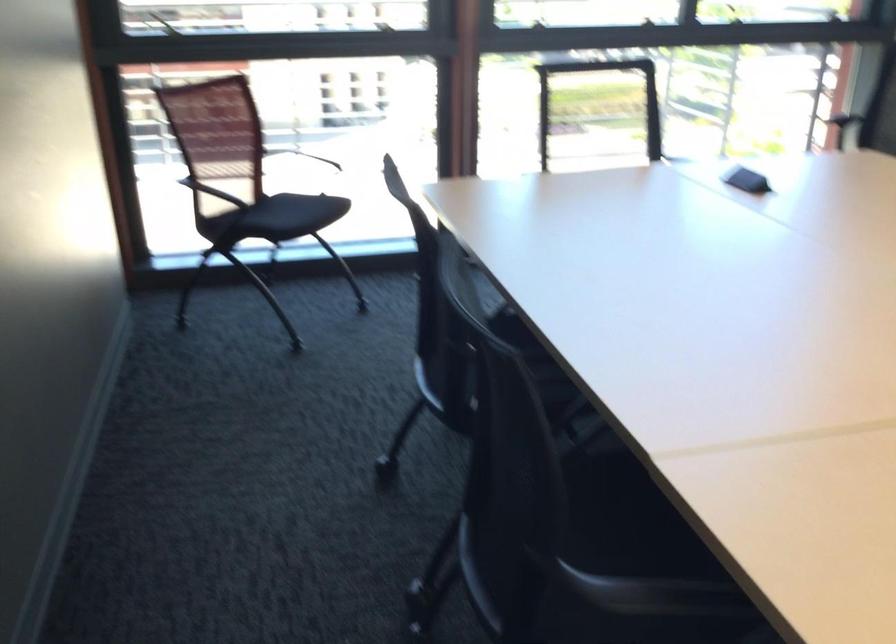
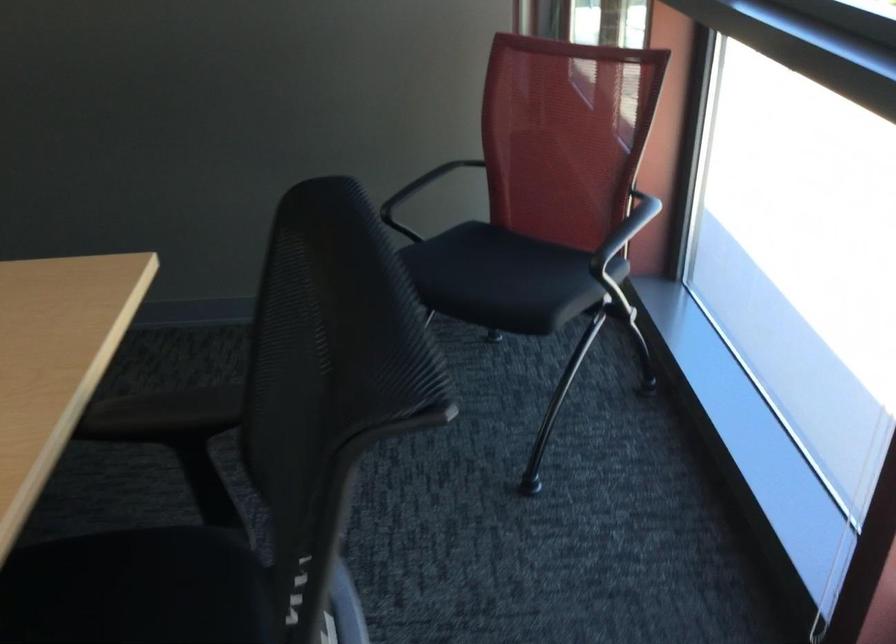
The point at (319,205) is marked in the first image. Where is the corresponding point in the second image?

(493, 277)